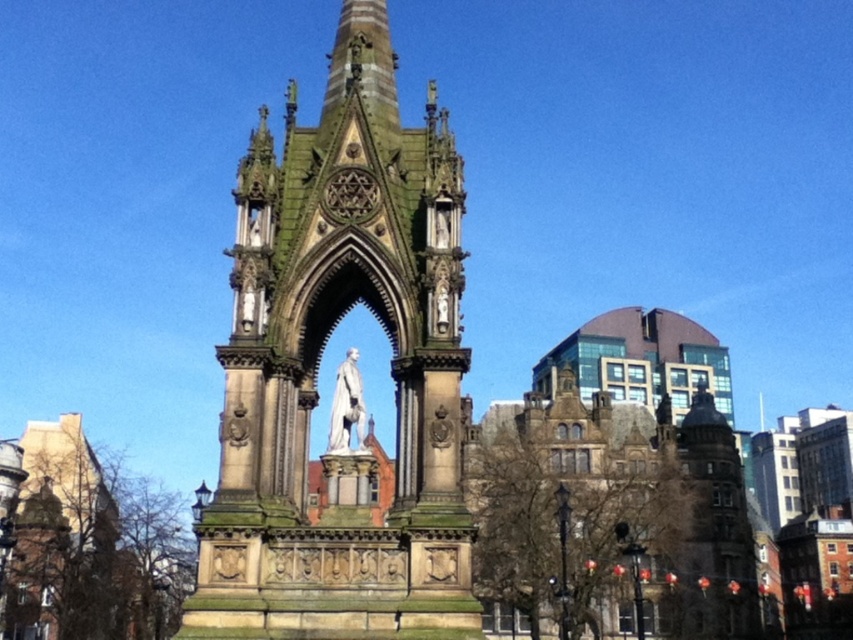
Who is positioned more to the right, green stone tower at center or white marble statue at center?

white marble statue at center is more to the right.

Who is more forward, (410, 182) or (352, 374)?

Point (352, 374)

Locate an element on the screen. green stone tower at center is located at coordinates (318, 362).